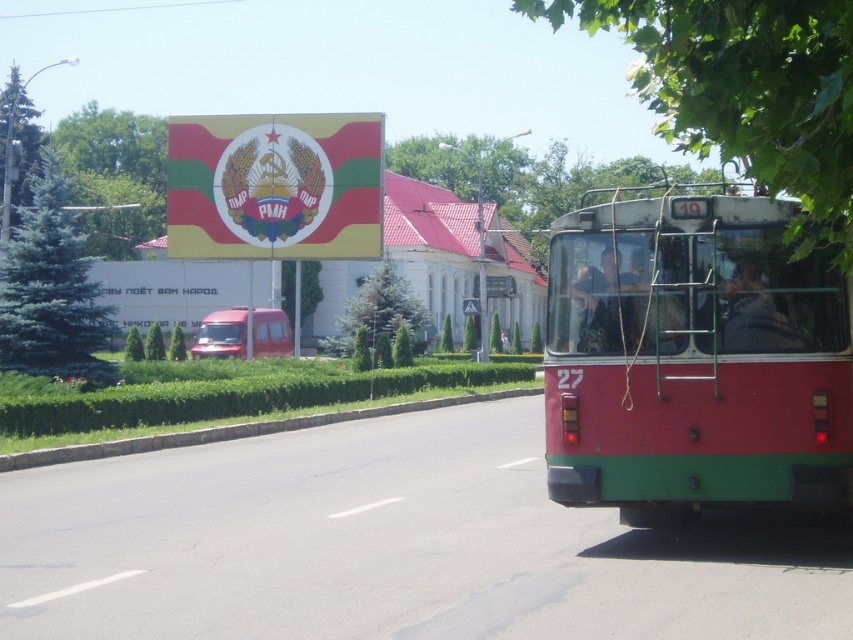
Is matte red bus at right positioned behind metallic red van at center?

No, matte red bus at right is in front of metallic red van at center.

Which is above, matte red bus at right or metallic red van at center?

metallic red van at center is above.

Does point (815, 378) come behind point (230, 323)?

That is False.

Find the location of `matte red bus at right`. matte red bus at right is located at coordinates (693, 360).